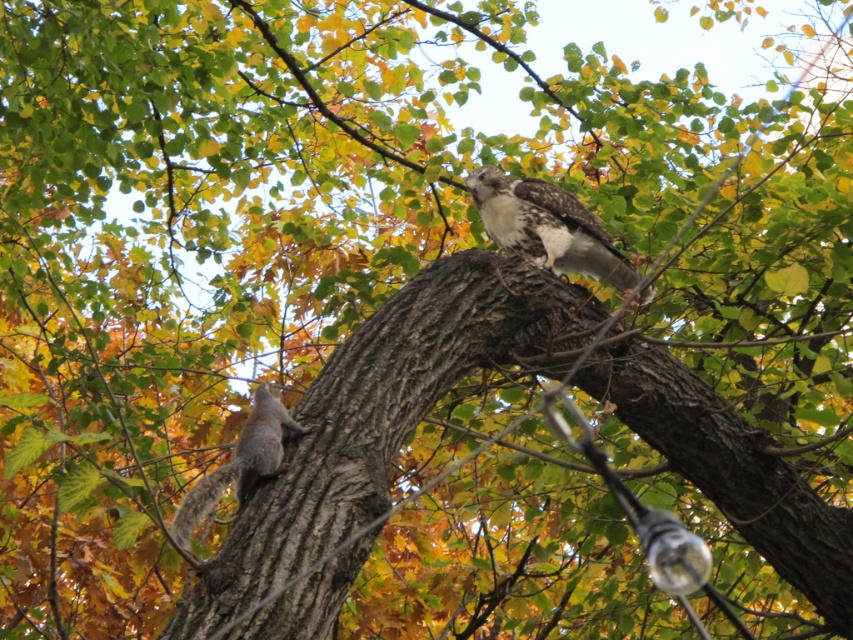
You are a birdwatcher observing the scene. You notice the brown rough tree trunk at center and the brown speckled feathers at upper center. Which object is taller?

The brown rough tree trunk at center is taller than the brown speckled feathers at upper center.

You are a photographer standing in front of the brown rough tree trunk at center and the gray fur squirrel at lower left. You want to take a photo that includes both subjects. Based on their positions, which subject is closer to the left side of the frame?

The gray fur squirrel at lower left is closer to the left side of the frame because the brown rough tree trunk at center is positioned to its right.

You are standing at the base of the tree and want to place a small bird feeder. There are two points marked on the tree trunk where you can attach it. The points are labeled as point 1 at coordinates [550,189] and point 2 at [184,500]. Which point is closer to the ground so the feeder is easier to reach?

Point 2 at coordinates [184,500] is closer to the ground, so placing the feeder there would be easier to reach.